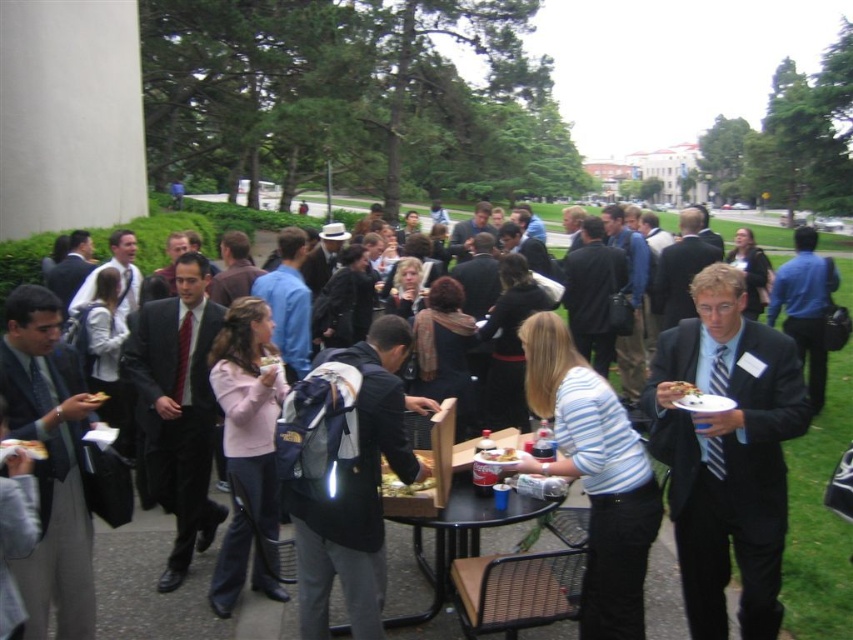
Which is above, dark gray backpack at center or black plastic table at center?

Positioned higher is black plastic table at center.

Locate an element on the screen. dark gray backpack at center is located at coordinates (358, 490).

The height and width of the screenshot is (640, 853). Find the location of `dark gray backpack at center`. dark gray backpack at center is located at coordinates 358,490.

Can you confirm if matte black suit at right is positioned to the left of striped cotton shirt at center?

Incorrect, matte black suit at right is not on the left side of striped cotton shirt at center.

Between matte black suit at right and striped cotton shirt at center, which one has more height?

matte black suit at right is taller.

Between point (788, 388) and point (601, 608), which one is positioned in front?

Point (788, 388)

At what (x,y) coordinates should I click in order to perform the action: click on matte black suit at right. Please return your answer as a coordinate pair (x, y). This screenshot has width=853, height=640. Looking at the image, I should click on (727, 452).

Between striped cotton shirt at center and white paper plate at upper center, which one appears on the left side from the viewer's perspective?

Positioned to the left is striped cotton shirt at center.

Locate an element on the screen. The width and height of the screenshot is (853, 640). striped cotton shirt at center is located at coordinates (595, 476).

Identify the location of striped cotton shirt at center. This screenshot has width=853, height=640. (595, 476).